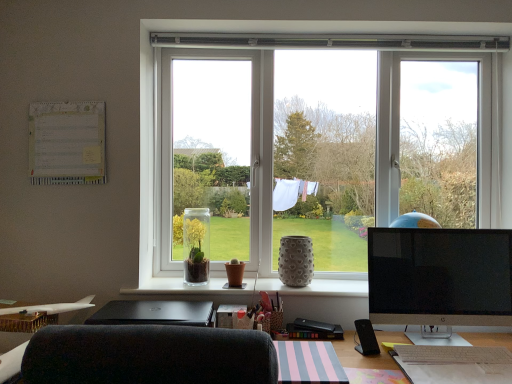
Question: From the image's perspective, does clear glass vase at center, the 3th vase positioned from the right, appear lower than white textured vase at center?

Choices:
 (A) no
 (B) yes

Answer: (A)

Question: From the image's perspective, would you say clear glass vase at center, which appears as the first vase when viewed from the left, is positioned over white textured vase at center?

Choices:
 (A) yes
 (B) no

Answer: (A)

Question: Is clear glass vase at center, the 3th vase positioned from the right, oriented towards white textured vase at center?

Choices:
 (A) yes
 (B) no

Answer: (B)

Question: Is the surface of clear glass vase at center, which appears as the first vase when viewed from the left, in direct contact with white textured vase at center?

Choices:
 (A) no
 (B) yes

Answer: (A)

Question: Is clear glass vase at center, the 3th vase positioned from the right, wider than white textured vase at center?

Choices:
 (A) yes
 (B) no

Answer: (B)

Question: From the image's perspective, is gray textured vase at center, which is the third vase in left-to-right order, above or below white paperboard at upper left?

Choices:
 (A) below
 (B) above

Answer: (A)

Question: From a real-world perspective, is gray textured vase at center, which is the 1th vase from right to left, physically located above or below white paperboard at upper left?

Choices:
 (A) above
 (B) below

Answer: (B)

Question: Visually, is gray textured vase at center, which is the 1th vase from right to left, positioned to the left or to the right of white paperboard at upper left?

Choices:
 (A) right
 (B) left

Answer: (A)

Question: In terms of width, does gray textured vase at center, which is the third vase in left-to-right order, look wider or thinner when compared to white paperboard at upper left?

Choices:
 (A) wide
 (B) thin

Answer: (A)

Question: Considering their positions, is white textured vase at center located in front of or behind brown matte vase at center, which is counted as the second vase, starting from the left?

Choices:
 (A) front
 (B) behind

Answer: (A)

Question: Based on their positions, is white textured vase at center located to the left or right of brown matte vase at center, the second vase positioned from the right?

Choices:
 (A) left
 (B) right

Answer: (B)

Question: Is white textured vase at center bigger or smaller than brown matte vase at center, the second vase positioned from the right?

Choices:
 (A) small
 (B) big

Answer: (B)

Question: Looking at their shapes, would you say white textured vase at center is wider or thinner than brown matte vase at center, which is counted as the second vase, starting from the left?

Choices:
 (A) thin
 (B) wide

Answer: (B)

Question: Visually, is black glossy monitor at right positioned to the left or to the right of brown matte vase at center, which is counted as the second vase, starting from the left?

Choices:
 (A) right
 (B) left

Answer: (A)

Question: Relative to brown matte vase at center, which is counted as the second vase, starting from the left, is black glossy monitor at right in front or behind?

Choices:
 (A) behind
 (B) front

Answer: (B)